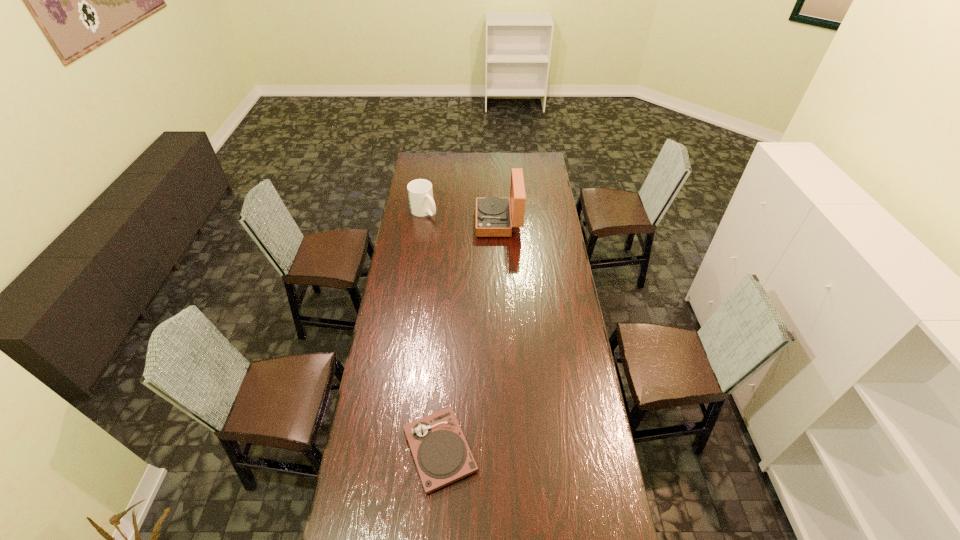
Locate an element on the screen. the tallest object is located at coordinates [493, 214].

This screenshot has width=960, height=540. I want to click on the taller phonograph_record, so click(x=493, y=214).

This screenshot has height=540, width=960. I want to click on the second shortest object, so click(420, 193).

The width and height of the screenshot is (960, 540). Identify the location of the nearer phonograph_record. (441, 453).

Identify the location of the shortest object. The height and width of the screenshot is (540, 960). (441, 453).

The image size is (960, 540). Find the location of `vacant space situated on the face of the tallest object`. vacant space situated on the face of the tallest object is located at coordinates (461, 222).

This screenshot has height=540, width=960. Identify the location of free point located 0.290m on the face of the tallest object. (422, 222).

The height and width of the screenshot is (540, 960). Identify the location of vacant space located 0.080m on the face of the tallest object. (461, 222).

Locate an element on the screen. vacant space located 0.230m on the front of the second tallest object is located at coordinates (419, 250).

Where is `vacant region located on the left of the nearer phonograph_record`? vacant region located on the left of the nearer phonograph_record is located at coordinates (358, 450).